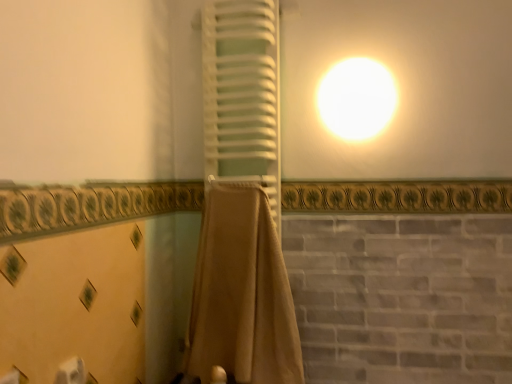
Question: Is beige fabric towel at center, which is the first curtain from bottom to top, inside the boundaries of white matte towel at center, which is the 1th curtain in top-to-bottom order, or outside?

Choices:
 (A) inside
 (B) outside

Answer: (B)

Question: In terms of height, does beige fabric towel at center, which ranks as the second curtain in top-to-bottom order, look taller or shorter compared to white matte towel at center, which is the 1th curtain in top-to-bottom order?

Choices:
 (A) tall
 (B) short

Answer: (B)

Question: Which of these objects is positioned farthest from the white matte towel at center, which is the 1th curtain in top-to-bottom order?

Choices:
 (A) white matte toilet paper at lower left
 (B) beige fabric towel at center, which ranks as the second curtain in top-to-bottom order

Answer: (A)

Question: Based on their relative distances, which object is farther from the beige fabric towel at center, which ranks as the second curtain in top-to-bottom order?

Choices:
 (A) white matte toilet paper at lower left
 (B) white matte towel at center, which is the 1th curtain in top-to-bottom order

Answer: (A)